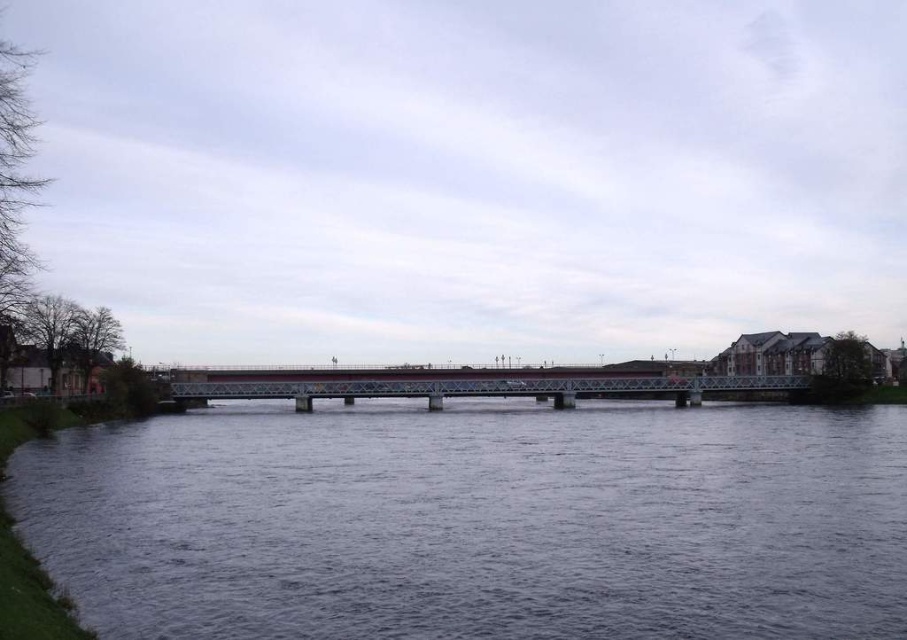
You are a boat captain planning to navigate a 100 feet long vessel through the river. The vessel requires a clear path of 120 feet to safely pass between the dark gray water at center and the metallic bridge at center. Can your vessel safely pass through this section of the river?

The distance between the dark gray water at center and the metallic bridge at center is 163.94 feet. Since the required clearance is 120 feet, the vessel can safely pass through this section as the available space exceeds the required clearance.